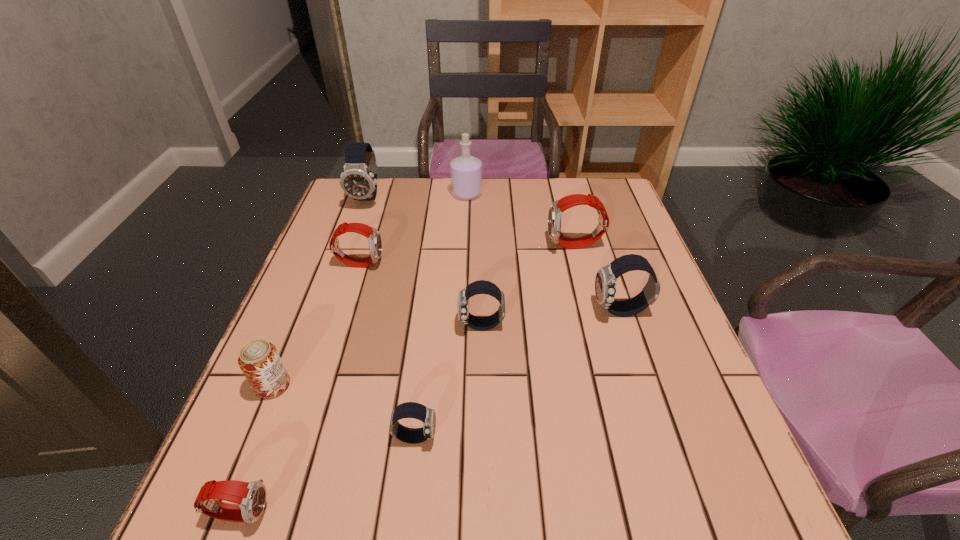
The height and width of the screenshot is (540, 960). What are the coordinates of `vacant area between the perfume and the second biggest red watch` in the screenshot? It's located at (413, 228).

Locate an element on the screen. vacant space that is in between the smallest dark watch and the third dark watch from left to right is located at coordinates (448, 381).

At what (x,y) coordinates should I click in order to perform the action: click on free space between the nearest dark watch and the third dark watch from left to right. Please return your answer as a coordinate pair (x, y). Looking at the image, I should click on (448, 381).

The image size is (960, 540). Identify the location of vacant area between the second smallest dark watch and the third smallest dark watch. (551, 318).

At what (x,y) coordinates should I click in order to perform the action: click on free space between the nearest object and the third biggest dark watch. Please return your answer as a coordinate pair (x, y). This screenshot has width=960, height=540. Looking at the image, I should click on (361, 418).

You are a GUI agent. You are given a task and a screenshot of the screen. Output one action in this format:
    pyautogui.click(x=<x>, y=<y>)
    Task: Click on the vacant point located between the third dark watch from right to left and the seventh farthest object
    The image size is (960, 540).
    Given the screenshot: What is the action you would take?
    pyautogui.click(x=344, y=411)

Point out which object is positioned as the seventh nearest to the second biggest red watch. Please provide its 2D coordinates. Your answer should be formatted as a tuple, i.e. [(x, y)], where the tuple contains the x and y coordinates of a point satisfying the conditions above.

[(605, 282)]

Where is `object identified as the fourth closest to the beer can`? The width and height of the screenshot is (960, 540). object identified as the fourth closest to the beer can is located at coordinates (478, 287).

Point out which watch is positioned as the third nearest to the nearest watch. Please provide its 2D coordinates. Your answer should be formatted as a tuple, i.e. [(x, y)], where the tuple contains the x and y coordinates of a point satisfying the conditions above.

[(375, 242)]

What are the coordinates of `the sixth closest watch to the third nearest object` in the screenshot? It's located at (605, 282).